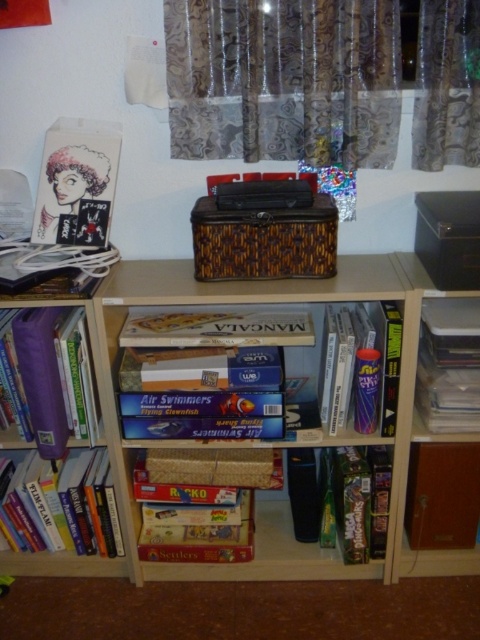
Can you confirm if textured fabric curtain at upper center is thinner than hardcover book at lower left?

No, textured fabric curtain at upper center is not thinner than hardcover book at lower left.

Which is in front, point (238, 116) or point (48, 476)?

Positioned in front is point (238, 116).

Locate an element on the screen. textured fabric curtain at upper center is located at coordinates (x=283, y=77).

Does textured fabric curtain at upper center come behind matte purple book at center?

No.

Which is in front, point (307, 92) or point (376, 333)?

Point (307, 92) is more forward.

In order to click on textured fabric curtain at upper center in this screenshot , I will do `click(283, 77)`.

Where is `purple matte book at lower left`? purple matte book at lower left is located at coordinates (57, 376).

Between point (87, 401) and point (344, 387), which one is positioned behind?

The point (344, 387) is more distant.

Locate an element on the screen. purple matte book at lower left is located at coordinates (57, 376).